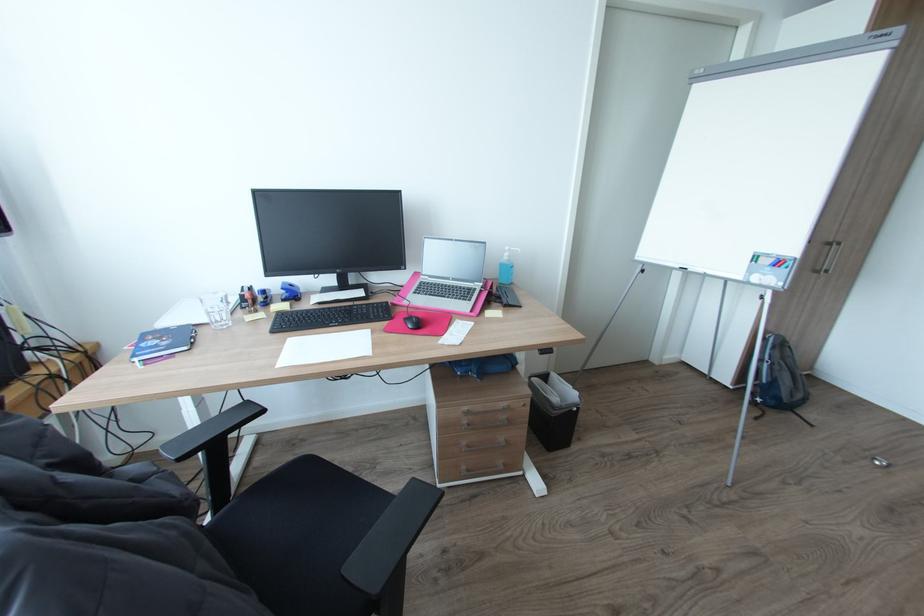
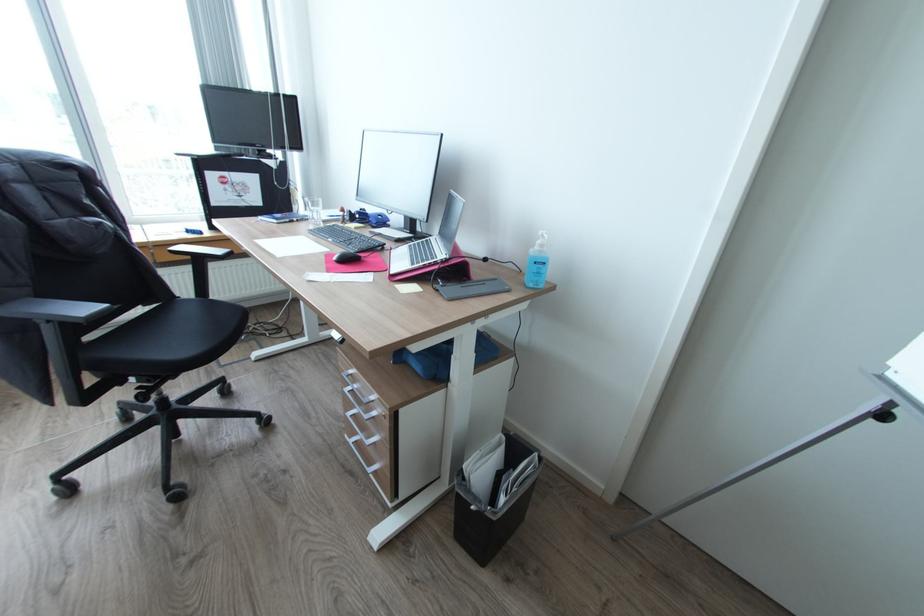
Where in the second image is the point corresponding to the point at 515,282 from the first image?

(536, 284)